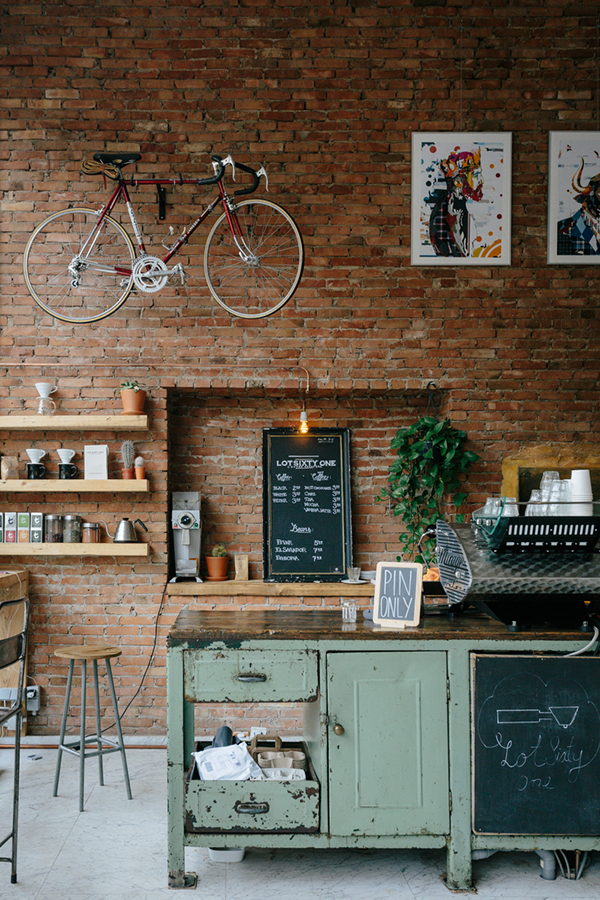
Image resolution: width=600 pixels, height=900 pixels. Identify the location of counter. (452, 648).